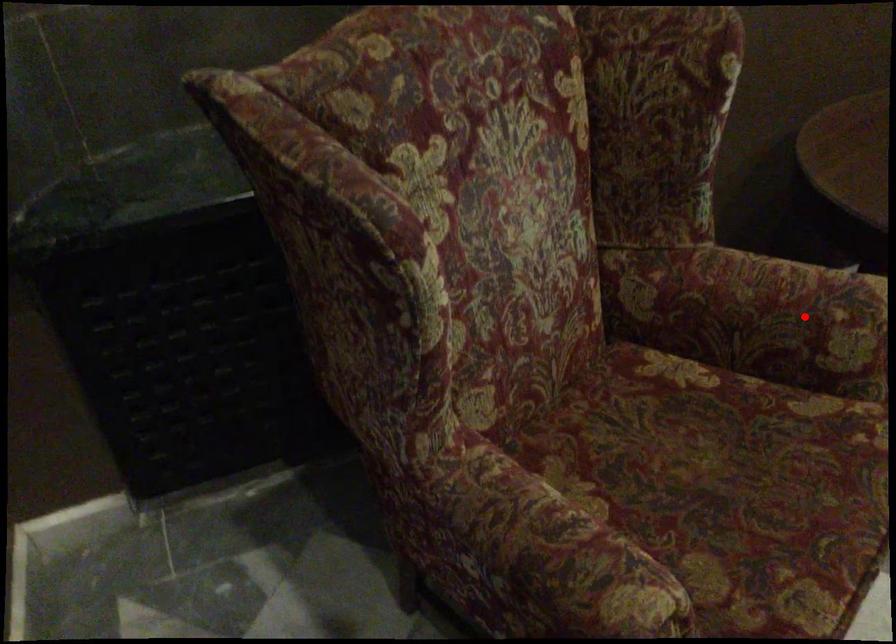
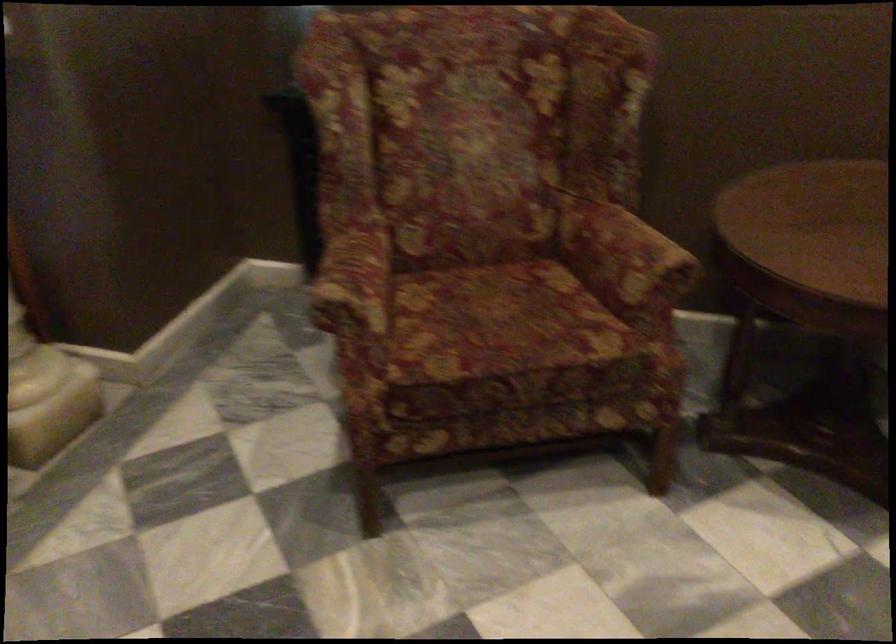
In the second image, find the point that corresponds to the highlighted location in the first image.

(624, 258)